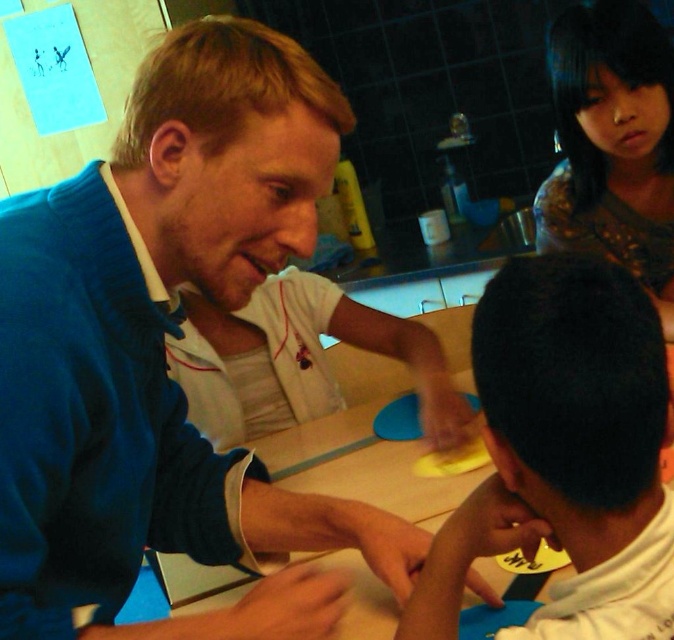
Locate an element on the screen. The height and width of the screenshot is (640, 674). blue fleece jacket at upper left is located at coordinates (162, 352).

Which of these two, blue fleece jacket at upper left or smooth yellow paper at center, stands taller?

blue fleece jacket at upper left is taller.

Describe the element at coordinates (162, 352) in the screenshot. I see `blue fleece jacket at upper left` at that location.

Image resolution: width=674 pixels, height=640 pixels. I want to click on blue fleece jacket at upper left, so click(x=162, y=352).

This screenshot has height=640, width=674. Describe the element at coordinates (162, 352) in the screenshot. I see `blue fleece jacket at upper left` at that location.

Can you confirm if blue fleece jacket at upper left is positioned above matte brown hair at upper right?

Incorrect, blue fleece jacket at upper left is not positioned above matte brown hair at upper right.

Locate an element on the screen. blue fleece jacket at upper left is located at coordinates (162, 352).

The image size is (674, 640). I want to click on blue fleece jacket at upper left, so click(x=162, y=352).

Can you confirm if blue fleece jacket at upper left is positioned to the right of wooden table at center?

Incorrect, blue fleece jacket at upper left is not on the right side of wooden table at center.

Locate an element on the screen. The height and width of the screenshot is (640, 674). blue fleece jacket at upper left is located at coordinates (162, 352).

Where is `blue fleece jacket at upper left`? blue fleece jacket at upper left is located at coordinates (162, 352).